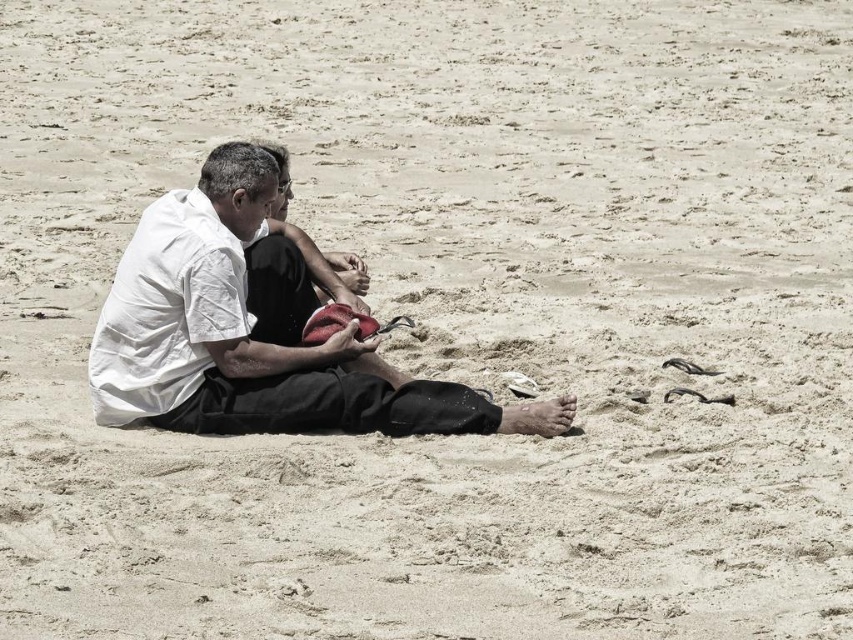
Question: Which object is closer to the camera taking this photo?

Choices:
 (A) black cotton shirt at center
 (B) white cotton shirt at center

Answer: (B)

Question: Is white cotton shirt at center further to camera compared to black cotton shirt at center?

Choices:
 (A) no
 (B) yes

Answer: (A)

Question: Where is white cotton shirt at center located in relation to black cotton shirt at center in the image?

Choices:
 (A) below
 (B) above

Answer: (A)

Question: Which point is farther to the camera?

Choices:
 (A) (409, 396)
 (B) (264, 145)

Answer: (B)

Question: Is the position of white cotton shirt at center more distant than that of black cotton shirt at center?

Choices:
 (A) no
 (B) yes

Answer: (A)

Question: Which point is closer to the camera?

Choices:
 (A) black cotton shirt at center
 (B) white cotton shirt at center

Answer: (B)